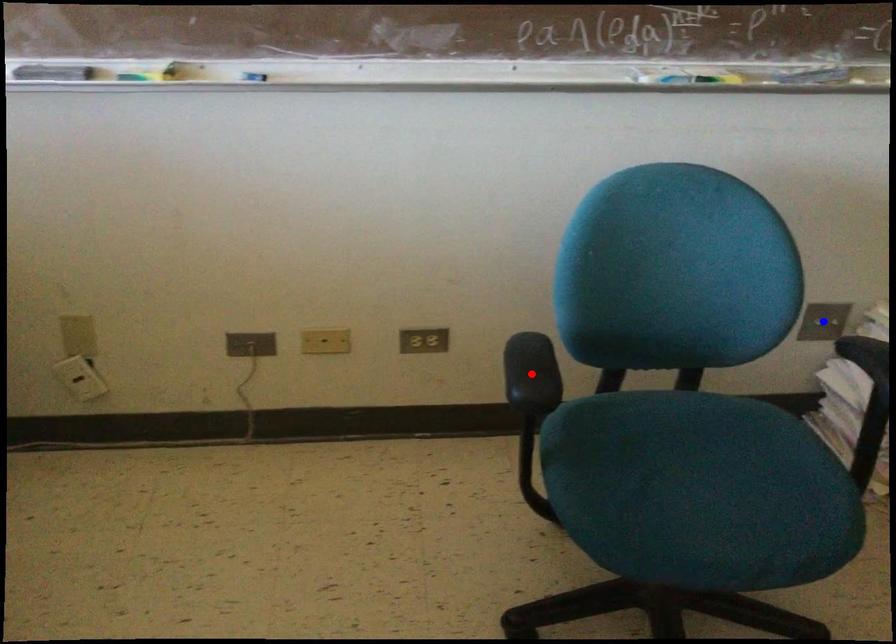
Question: Two points are marked on the image. Which point is closer to the camera?

Choices:
 (A) Blue point is closer.
 (B) Red point is closer.

Answer: (B)